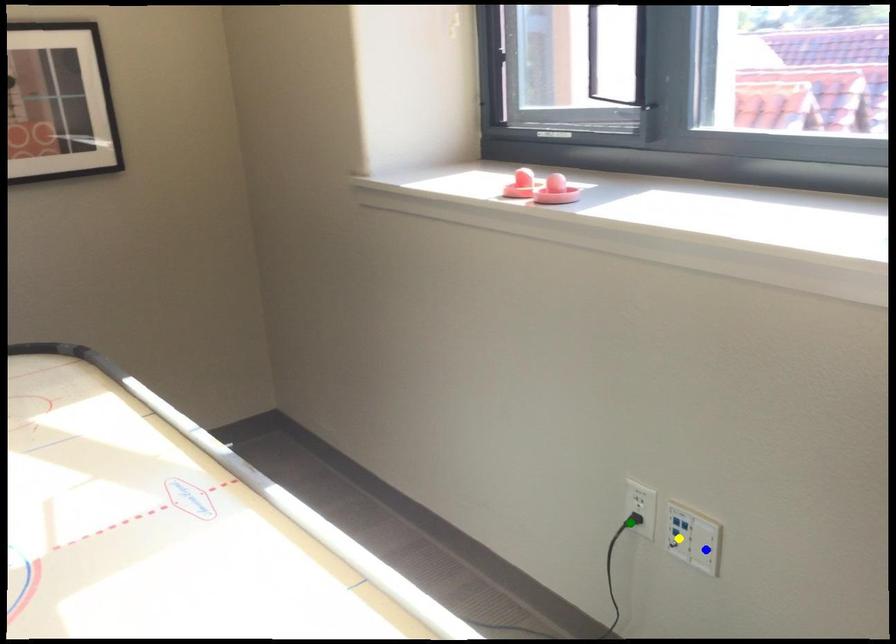
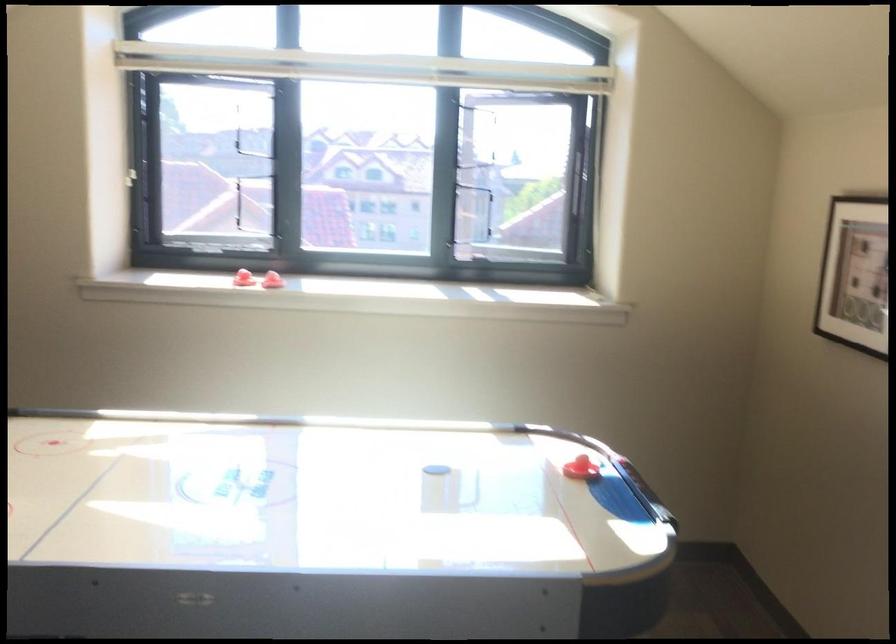
I am providing you with two images of the same scene from different viewpoints. Three points are marked in image1. Which point corresponds to a part or object that is occluded in image2?In image1, three points are marked. Which of them correspond to a part or object that is occluded in image2?Among the three points shown in image1, which one corresponds to a part or object that is no longer visible due to occlusion in image2?

Invisible in image2: yellow point, green point, blue point.